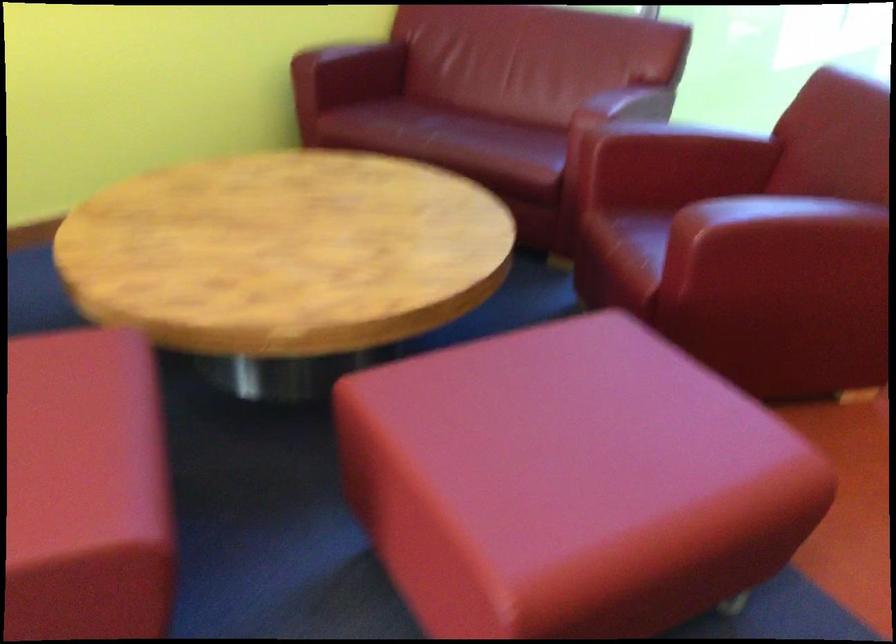
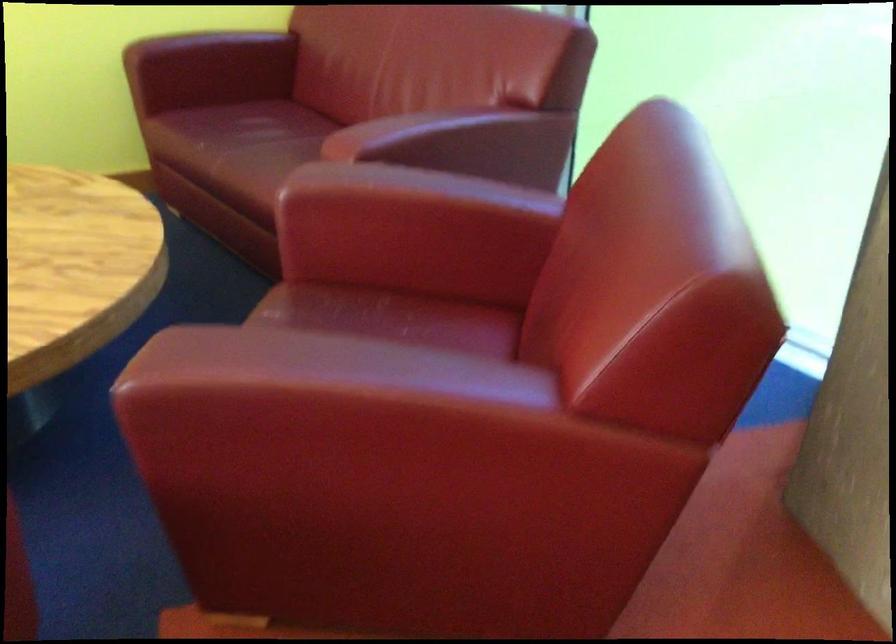
In a continuous first-person perspective shot, in which direction is the camera moving?

The cameraman moved toward right, forward.